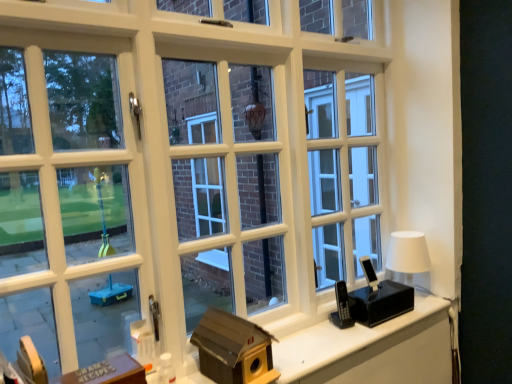
Where is `free space above wooden birdhouse at lower right (from a real-world perspective)`? free space above wooden birdhouse at lower right (from a real-world perspective) is located at coordinates (339, 339).